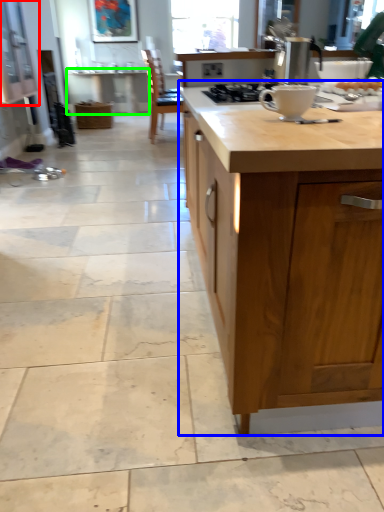
Question: Estimate the real-world distances between objects in this image. Which object is farther from cabinetry (highlighted by a red box), countertop (highlighted by a blue box) or table (highlighted by a green box)?

Choices:
 (A) countertop
 (B) table

Answer: (A)